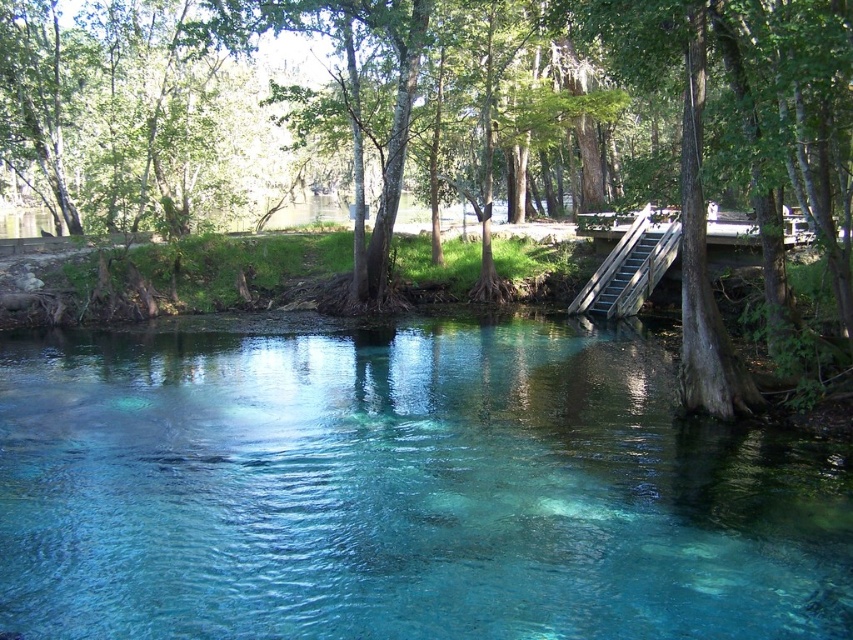
Question: Does green rough bark tree at center have a lesser width compared to wooden stairs at center-right?

Choices:
 (A) no
 (B) yes

Answer: (A)

Question: Can you confirm if clear glassy water at center is bigger than green rough bark tree at center?

Choices:
 (A) yes
 (B) no

Answer: (B)

Question: Which of the following is the closest to the observer?

Choices:
 (A) (485, 129)
 (B) (26, 518)

Answer: (B)

Question: Among these points, which one is nearest to the camera?

Choices:
 (A) click(666, 237)
 (B) click(640, 388)

Answer: (B)

Question: Which of these objects is positioned farthest from the wooden stairs at center-right?

Choices:
 (A) clear glassy water at center
 (B) green rough bark tree at center

Answer: (A)

Question: Does clear glassy water at center have a larger size compared to wooden stairs at center-right?

Choices:
 (A) yes
 (B) no

Answer: (A)